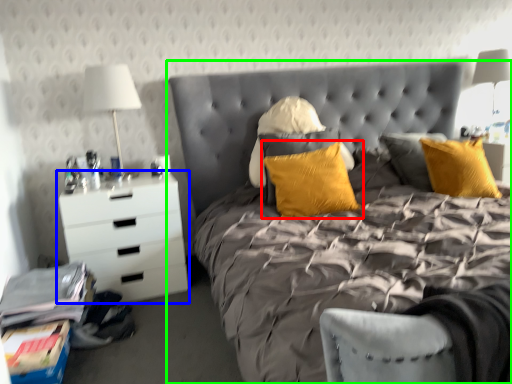
Question: Based on their relative distances, which object is farther from pillow (highlighted by a red box)? Choose from chest of drawers (highlighted by a blue box) and bed (highlighted by a green box).

Choices:
 (A) chest of drawers
 (B) bed

Answer: (A)